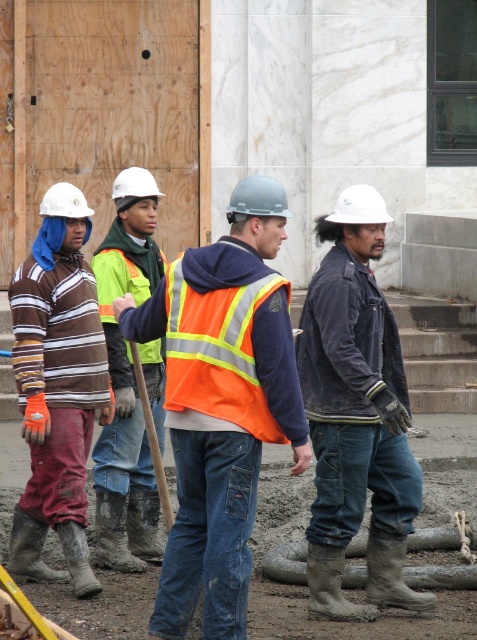
You are a safety inspector at the construction site. You notice two workers wearing dark gray leather jacket at center and matte brown striped shirt at left. According to the safety protocol, workers must maintain a minimum distance of 2 meters between each other to avoid accidents. Can you determine if they are complying with this rule based on their positions?

The dark gray leather jacket at center is in front of the matte brown striped shirt at left, but the distance between them is not specified in the description. Therefore, it is impossible to confirm if they are maintaining the required 2 meters of distance.

You are a safety inspector at the construction site. You notice two orange vests in the image. The first is labeled as an orange reflective vest at center, and the second is an orange reflective safety vest at center. According to safety protocols, the vest must be worn above the clothing. Which one is violating the safety protocol?

The orange reflective vest at center is located below the orange reflective safety vest at center, meaning the orange reflective vest at center is worn underneath the other vest, violating the safety protocol.